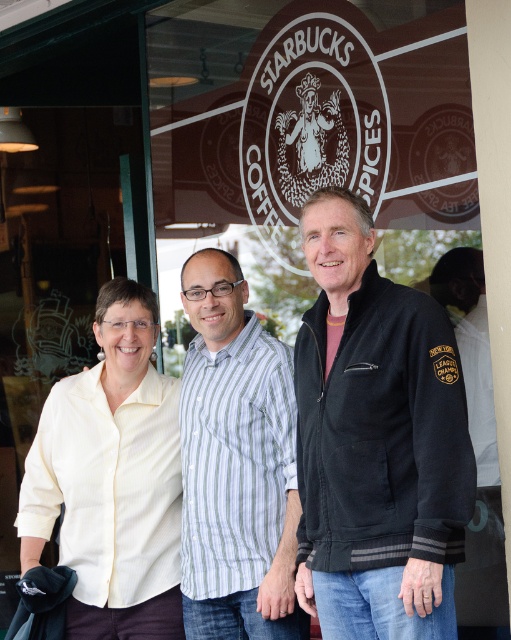
In the scene shown: You are trying to decide which of the two striped shirts in the image is the shorter one. The two shirts are the yellow striped shirt at center and the striped cotton shirt at center. Based on the description, which one is shorter?

The yellow striped shirt at center is shorter than the striped cotton shirt at center according to the description.

You are standing in front of the Starbucks Coffee storefront and see two points marked on the glass door. The first point is at coordinates point (337, 596) and the second is at point (223, 380). Which point is closer to the camera?

Point (337, 596) is in front of point (223, 380), so it is closer to the camera.

You are a photographer trying to adjust the lighting for a photo shoot at the Starbucks storefront. You notice the black fleece jacket at center and want to ensure it is well lit. Based on its position at point 0.689, 0.736, can you determine if it is positioned closer to the left or right side of the frame?

The black fleece jacket at center is located at point (376,440). Since the x coordinate is 0.689, which is closer to 1.0 than 0.0, it is positioned closer to the right side of the frame.